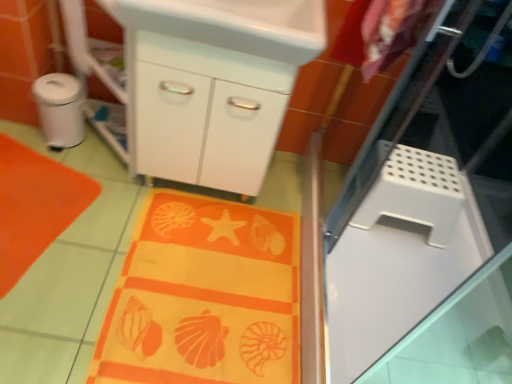
Question: From their relative heights in the image, would you say white plastic step stool at right, the 1th appliance from the bottom, is taller or shorter than white plastic trash can at left, which appears as the 1th appliance when viewed from the top?

Choices:
 (A) short
 (B) tall

Answer: (A)

Question: Is white plastic step stool at right, which ranks as the second appliance in left-to-right order, spatially inside white plastic trash can at left, acting as the first appliance starting from the left, or outside of it?

Choices:
 (A) inside
 (B) outside

Answer: (B)

Question: Which of these objects is positioned closest to the orange fabric beach towel at lower left?

Choices:
 (A) orange fabric at lower center
 (B) white plastic step stool at right, the 1th appliance from the bottom
 (C) white glossy sink at upper center
 (D) white perforated screen door at right
 (E) white plastic trash can at left, the 2th appliance viewed from the right

Answer: (E)

Question: Estimate the real-world distances between objects in this image. Which object is farther from the white plastic trash can at left, which is the second appliance in bottom-to-top order?

Choices:
 (A) orange fabric beach towel at lower left
 (B) white glossy sink at upper center
 (C) orange fabric at lower center
 (D) white perforated screen door at right
 (E) white plastic step stool at right, which is counted as the first appliance, starting from the right

Answer: (D)